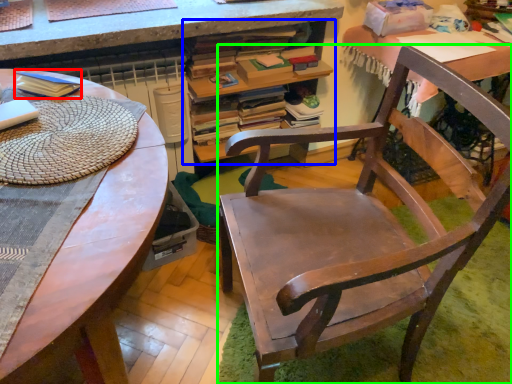
Question: Which object is positioned closest to paperback book (highlighted by a red box)? Select from desk with bookshelf (highlighted by a blue box) and chair (highlighted by a green box).

Choices:
 (A) desk with bookshelf
 (B) chair

Answer: (A)